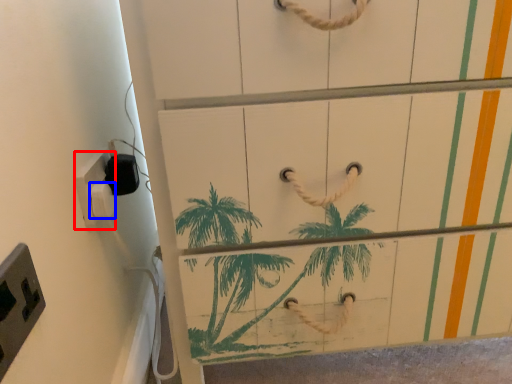
Question: Which of the following is the farthest to the observer, light switch (highlighted by a red box) or light switch (highlighted by a blue box)?

Choices:
 (A) light switch
 (B) light switch

Answer: (B)